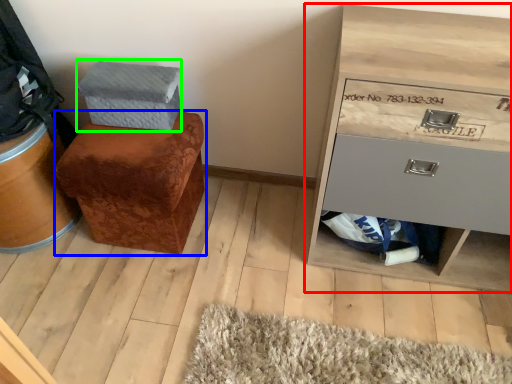
Question: Which object is positioned farthest from chest of drawers (highlighted by a red box)? Select from furniture (highlighted by a blue box) and shoe box (highlighted by a green box).

Choices:
 (A) furniture
 (B) shoe box

Answer: (B)